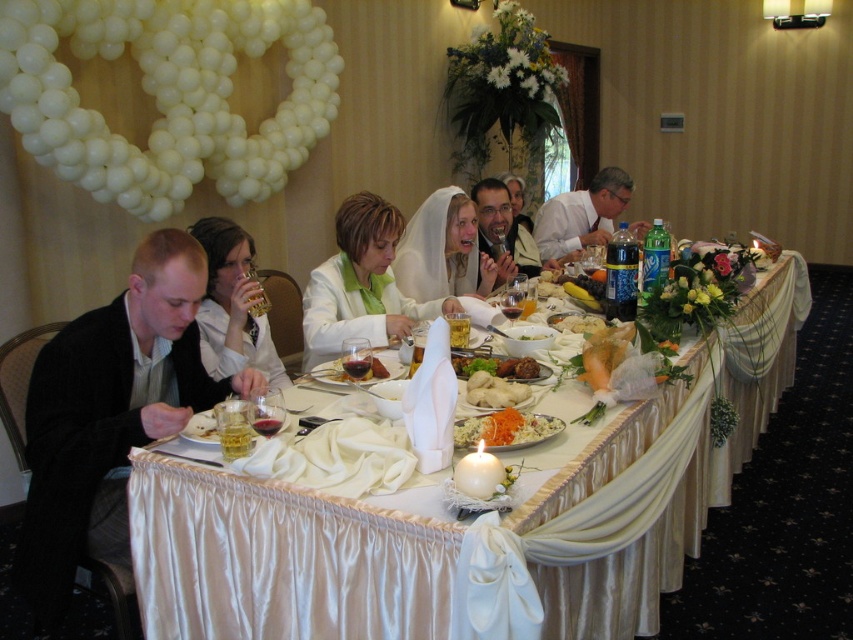
Does matte black jacket at center lie in front of white glossy rice at center?

No, it is not.

The image size is (853, 640). Find the location of `matte black jacket at center`. matte black jacket at center is located at coordinates (502, 230).

Who is positioned more to the left, white glossy rice at center or translucent glass wine at table center?

Positioned to the left is translucent glass wine at table center.

Who is more distant from viewer, [508,413] or [334,369]?

The point [334,369] is more distant.

Identify the location of white glossy rice at center. (505, 429).

Who is more distant from viewer, [45,452] or [201,228]?

The point [201,228] is more distant.

Is black sweater at left smaller than matte white shirt at left?

No, black sweater at left is not smaller than matte white shirt at left.

The width and height of the screenshot is (853, 640). What are the coordinates of `black sweater at left` in the screenshot? It's located at (111, 413).